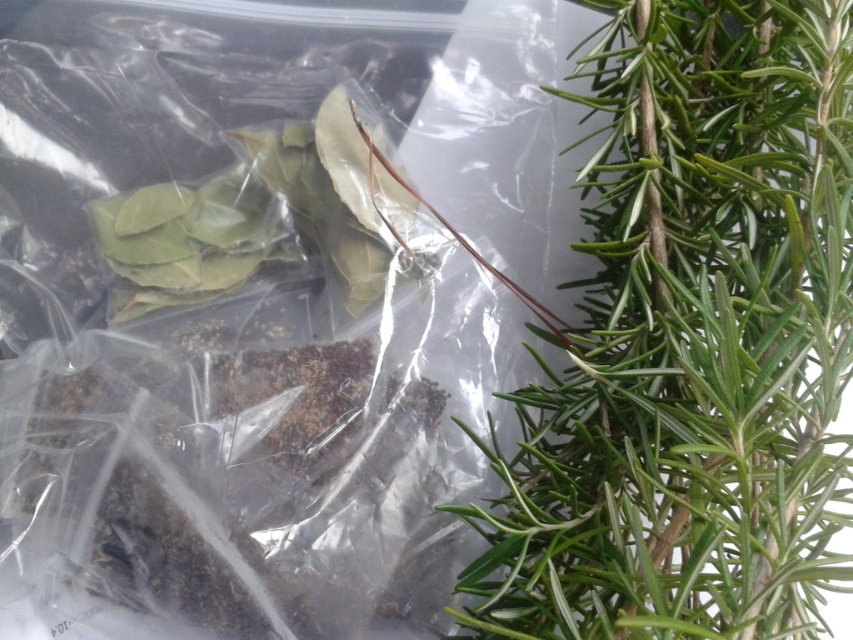
What do you see at coordinates (257, 307) in the screenshot? I see `transparent plastic bag at upper right` at bounding box center [257, 307].

Which of these two, transparent plastic bag at upper right or green needle-like leaves at upper right, stands shorter?

With less height is green needle-like leaves at upper right.

Between point (370, 276) and point (583, 540), which one is positioned behind?

The point (370, 276) is more distant.

This screenshot has height=640, width=853. Identify the location of transparent plastic bag at upper right. (257, 307).